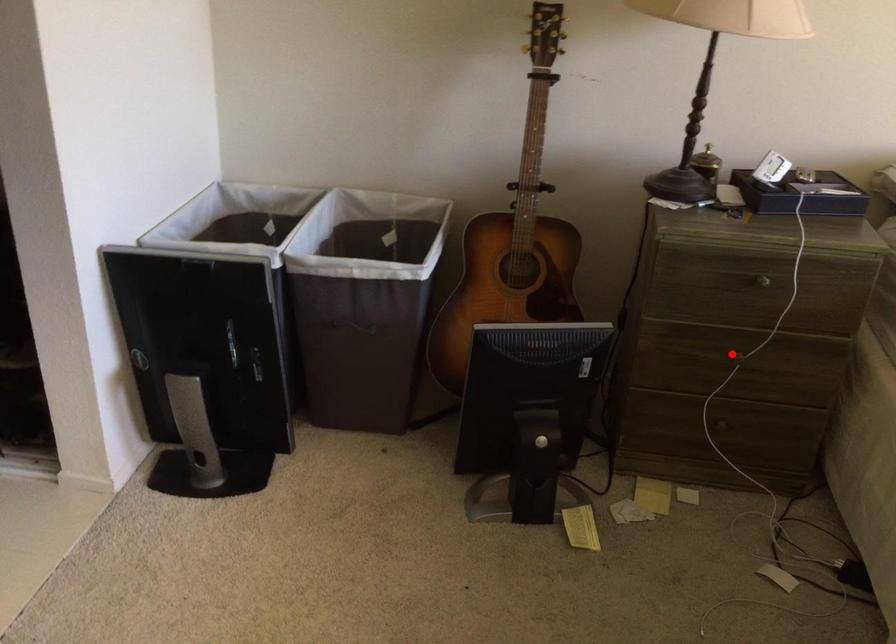
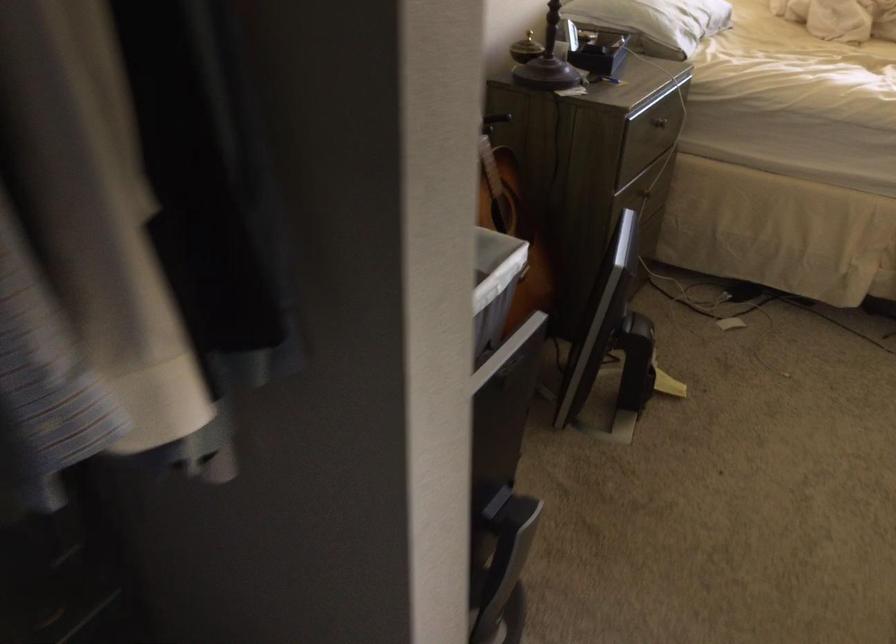
Question: I am providing you with two images of the same scene from different viewpoints. In image1, a red point is highlighted. Considering the same 3D point in image2, which of the following is correct?

Choices:
 (A) It is closer
 (B) It is farther

Answer: (B)